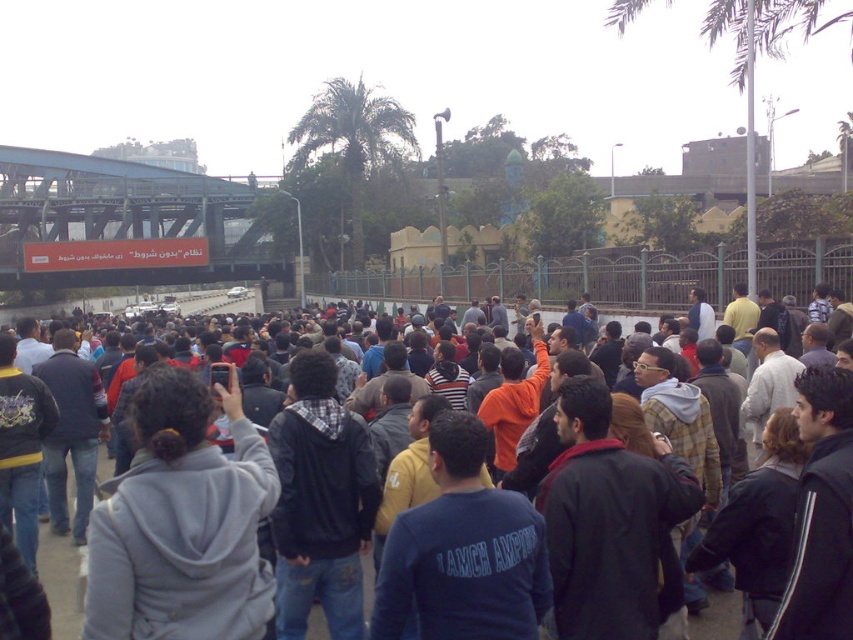
Is green leafy palm tree at upper center wider than dark gray hoodie at center?

In fact, green leafy palm tree at upper center might be narrower than dark gray hoodie at center.

Is the position of green leafy palm tree at upper center more distant than that of dark gray hoodie at center?

Yes.

Between point (299, 141) and point (39, 525), which one is positioned behind?

Positioned behind is point (299, 141).

Image resolution: width=853 pixels, height=640 pixels. In order to click on green leafy palm tree at upper center in this screenshot , I will do `click(352, 138)`.